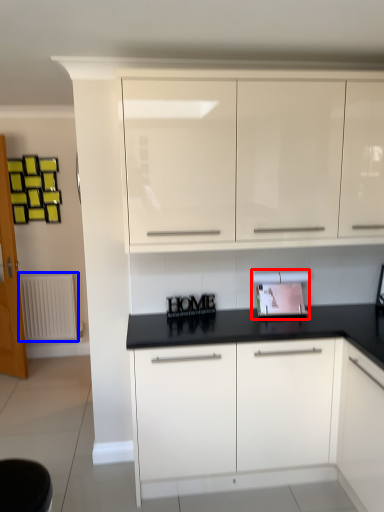
Question: Which of the following is the closest to the observer, appliance (highlighted by a red box) or radiator (highlighted by a blue box)?

Choices:
 (A) appliance
 (B) radiator

Answer: (A)